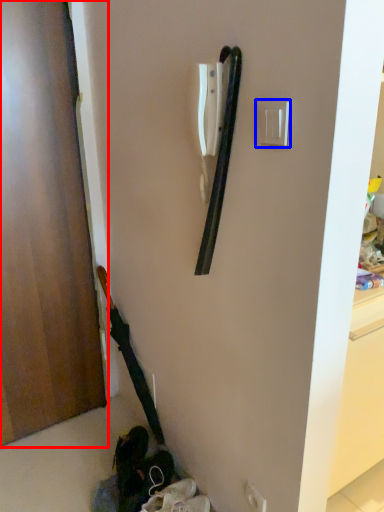
Question: Which object appears closest to the camera in this image, door (highlighted by a red box) or light switch (highlighted by a blue box)?

Choices:
 (A) door
 (B) light switch

Answer: (B)